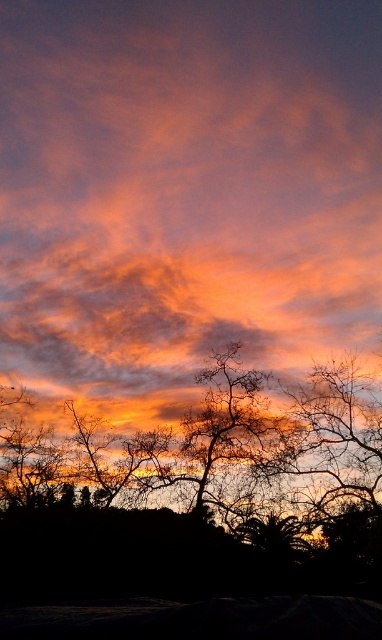
Does cloudy orange sky at center appear on the right side of silhouette leafless tree at bottom?

Correct, you'll find cloudy orange sky at center to the right of silhouette leafless tree at bottom.

Who is positioned more to the right, cloudy orange sky at center or silhouette leafless tree at bottom?

Positioned to the right is cloudy orange sky at center.

Locate an element on the screen. cloudy orange sky at center is located at coordinates (184, 192).

Which is below, cloudy orange sky at center or green leafy tree at lower center?

green leafy tree at lower center is below.

Is point (11, 1) closer to viewer compared to point (249, 520)?

No, (11, 1) is further to viewer.

Does point (244, 160) lie behind point (286, 554)?

That is True.

What are the coordinates of `cloudy orange sky at center` in the screenshot? It's located at (184, 192).

From the picture: Is silhouette leafless tree at bottom thinner than green leafy tree at lower center?

Incorrect, silhouette leafless tree at bottom's width is not less than green leafy tree at lower center's.

From the picture: Is silhouette leafless tree at bottom bigger than green leafy tree at lower center?

Indeed, silhouette leafless tree at bottom has a larger size compared to green leafy tree at lower center.

You are a GUI agent. You are given a task and a screenshot of the screen. Output one action in this format:
    pyautogui.click(x=<x>, y=<y>)
    Task: Click on the silhouette leafless tree at bottom
    The image size is (382, 640).
    Given the screenshot: What is the action you would take?
    pyautogui.click(x=202, y=477)